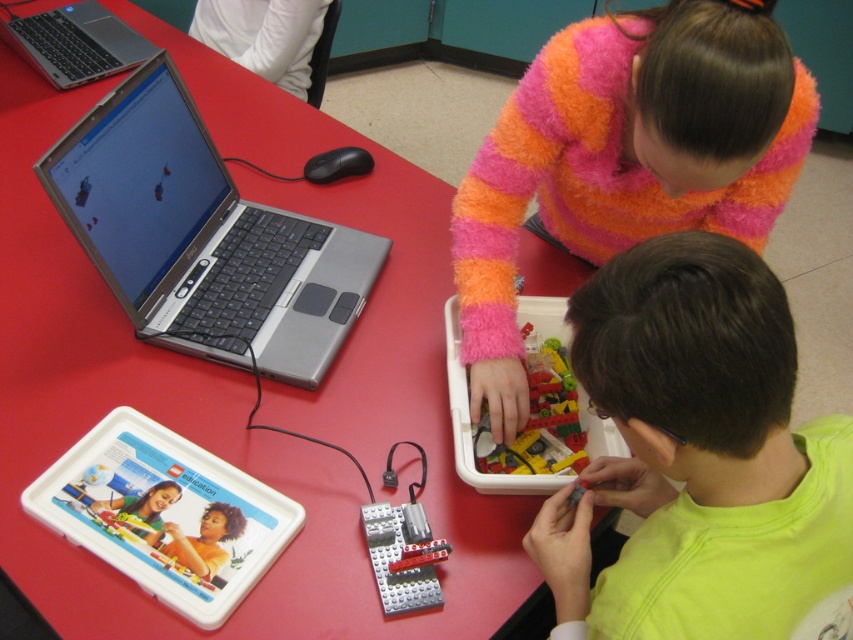
Between bright green fabric at lower right and silver metallic laptop at left, which one appears on the left side from the viewer's perspective?

Positioned to the left is silver metallic laptop at left.

Who is lower down, bright green fabric at lower right or silver metallic laptop at left?

bright green fabric at lower right

Describe the element at coordinates (700, 458) in the screenshot. This screenshot has width=853, height=640. I see `bright green fabric at lower right` at that location.

The width and height of the screenshot is (853, 640). In order to click on bright green fabric at lower right in this screenshot , I will do `click(700, 458)`.

Is silver metallic laptop at left above silver metallic laptop at upper left?

No, silver metallic laptop at left is not above silver metallic laptop at upper left.

Looking at this image, between silver metallic laptop at left and silver metallic laptop at upper left, which one is positioned higher?

silver metallic laptop at upper left is higher up.

What do you see at coordinates (202, 237) in the screenshot? This screenshot has height=640, width=853. I see `silver metallic laptop at left` at bounding box center [202, 237].

Find the location of a particular element. The height and width of the screenshot is (640, 853). silver metallic laptop at left is located at coordinates (202, 237).

Is bright green fabric at lower right shorter than translucent plastic lego bricks at center?

No, bright green fabric at lower right is not shorter than translucent plastic lego bricks at center.

In the scene shown: Is bright green fabric at lower right positioned behind translucent plastic lego bricks at center?

No, bright green fabric at lower right is closer to the viewer.

In order to click on bright green fabric at lower right in this screenshot , I will do `click(700, 458)`.